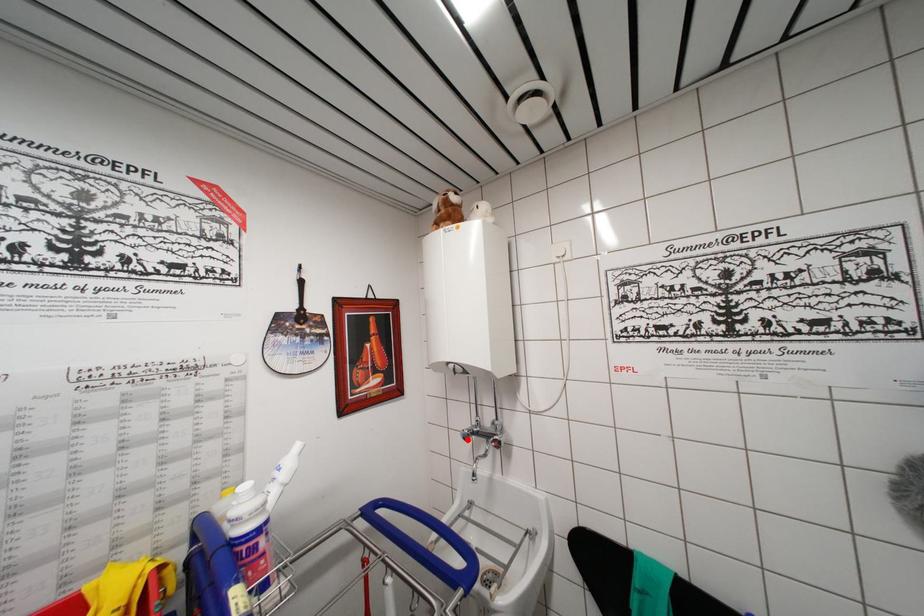
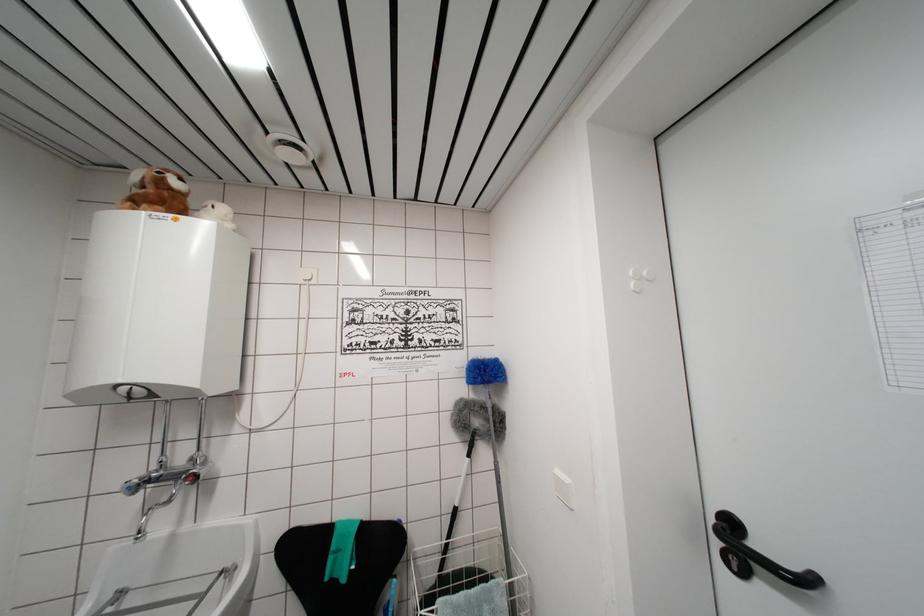
Find the pixel in the second image that matches the highlighted location in the first image.

(132, 493)